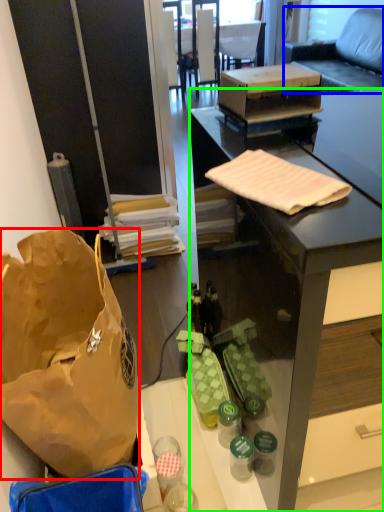
Question: Based on their relative distances, which object is nearer to handbag (highlighted by a red box)? Choose from studio couch (highlighted by a blue box) and desk (highlighted by a green box).

Choices:
 (A) studio couch
 (B) desk

Answer: (B)